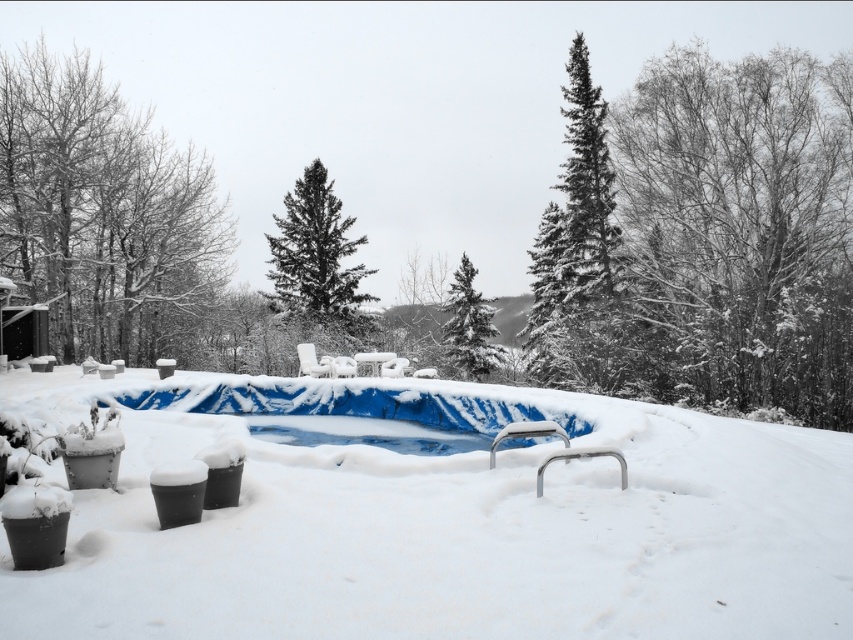
Question: Which is farther from the snow-covered evergreen tree at upper right?

Choices:
 (A) white fluffy snow at center
 (B) blue plastic pool at center

Answer: (B)

Question: Which of the following is the farthest from the observer?

Choices:
 (A) [x=399, y=442]
 (B) [x=125, y=228]
 (C) [x=442, y=595]

Answer: (B)

Question: Considering the relative positions of snow-covered evergreen tree at upper left and snow-covered evergreen tree at upper right in the image provided, where is snow-covered evergreen tree at upper left located with respect to snow-covered evergreen tree at upper right?

Choices:
 (A) right
 (B) left

Answer: (B)

Question: Which object is positioned closest to the snow-covered evergreen tree at upper right?

Choices:
 (A) snow-covered evergreen tree at center
 (B) white fluffy snow at center
 (C) snow-covered evergreen at upper right

Answer: (C)

Question: Can you confirm if snow-covered evergreen tree at upper left is bigger than dark green textured evergreen tree at center?

Choices:
 (A) yes
 (B) no

Answer: (A)

Question: Can you confirm if white fluffy snow at center is positioned to the left of snow-covered evergreen at upper right?

Choices:
 (A) yes
 (B) no

Answer: (A)